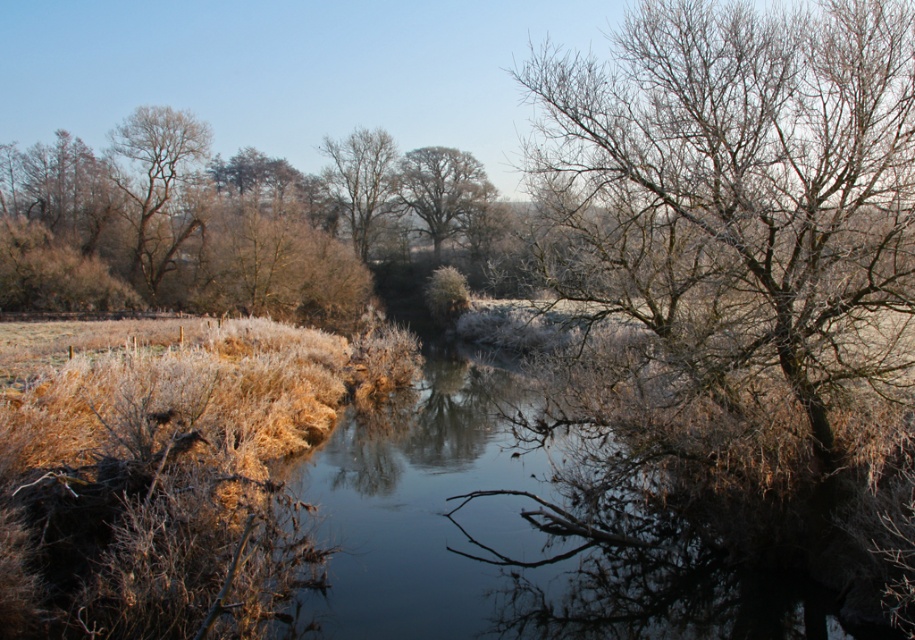
Question: Can you confirm if frosted branches at upper right is positioned above smooth bark tree at center?

Choices:
 (A) yes
 (B) no

Answer: (B)

Question: Among these points, which one is nearest to the camera?

Choices:
 (A) pos(388,202)
 (B) pos(424,196)
 (C) pos(170,252)

Answer: (C)

Question: Which point appears farthest from the camera in this image?

Choices:
 (A) (352, 177)
 (B) (891, 337)

Answer: (A)

Question: Can you confirm if frosted branches at upper right is thinner than smooth bark tree at center?

Choices:
 (A) no
 (B) yes

Answer: (B)

Question: Can you confirm if frosted branches at upper right is wider than smooth bark tree at center?

Choices:
 (A) no
 (B) yes

Answer: (A)

Question: Which object is closer to the camera taking this photo?

Choices:
 (A) bare branches at left
 (B) bare wood tree at center

Answer: (A)